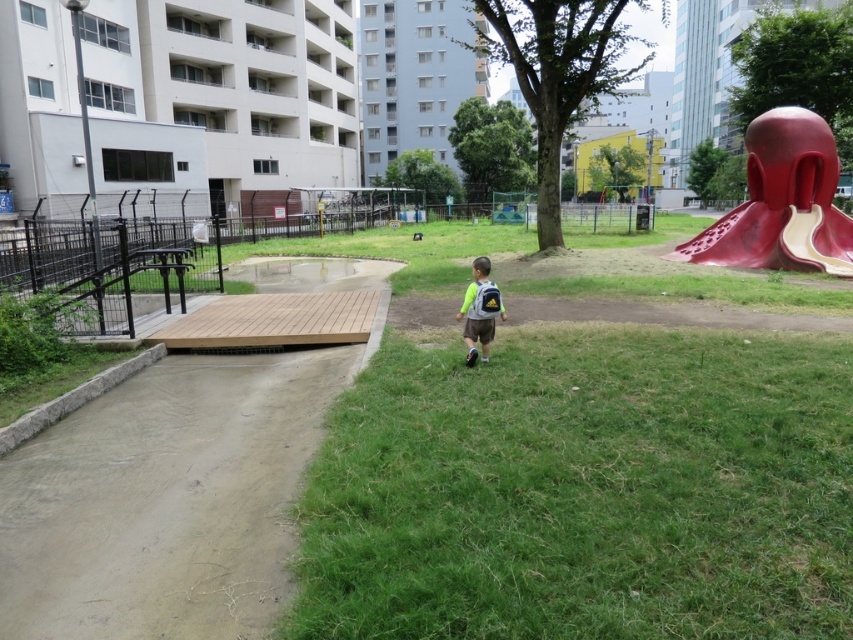
Does point (828, 228) come closer to viewer compared to point (471, 305)?

No, (828, 228) is further to viewer.

Who is taller, smooth red slide at right or light green fabric backpack at center?

Standing taller between the two is smooth red slide at right.

This screenshot has height=640, width=853. Find the location of `smooth red slide at right`. smooth red slide at right is located at coordinates (781, 202).

Does green grassy at lower right have a smaller size compared to smooth red slide at right?

Indeed, green grassy at lower right has a smaller size compared to smooth red slide at right.

Does green grassy at lower right have a larger size compared to smooth red slide at right?

Incorrect, green grassy at lower right is not larger than smooth red slide at right.

The image size is (853, 640). In order to click on green grassy at lower right in this screenshot , I will do `click(584, 490)`.

Looking at this image, between green grassy at lower right and light green fabric backpack at center, which one is positioned lower?

green grassy at lower right is lower down.

Can you confirm if green grassy at lower right is positioned to the left of light green fabric backpack at center?

No, green grassy at lower right is not to the left of light green fabric backpack at center.

Does point (643, 580) come behind point (476, 332)?

No, (643, 580) is closer to viewer.

Identify the location of green grassy at lower right. (584, 490).